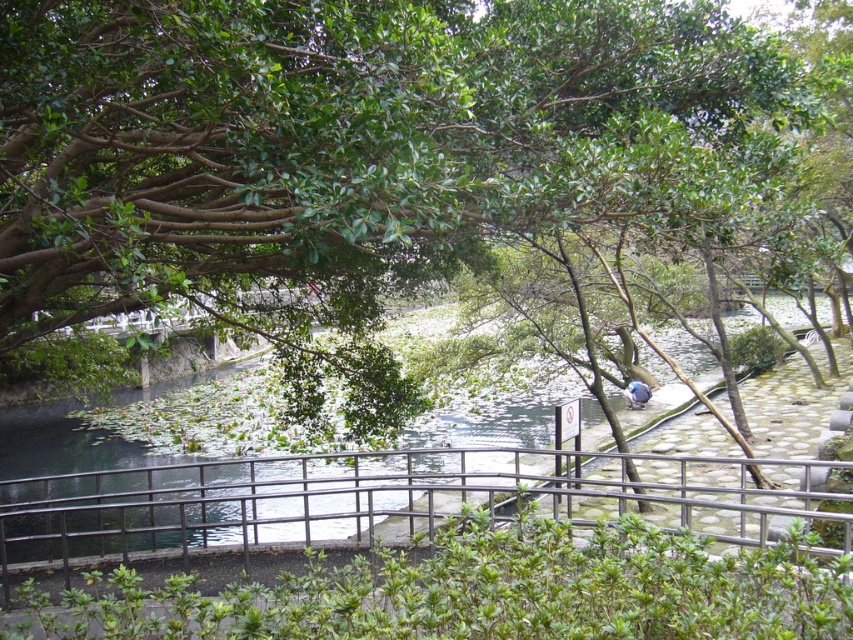
You are standing in the serene outdoor scene and want to take a photo of the green leafy tree at upper center. According to the image coordinates, where exactly should you aim your camera to capture it?

The green leafy tree at upper center is located at the 2D coordinates point (351,145), so you should aim your camera at that point to capture it.

You are standing at the metal railing in the middle of the scene and want to look at two points in the image, point (483, 136) and point (264, 499). Which point is closer to you?

Point (483, 136) is closer to the viewer than point (264, 499).

You are a painter standing at the edge of the water and want to paint the green leafy tree at upper center and the metallic gray railing at center. Which object is closer to the water surface?

The metallic gray railing at center is closer to the water surface because the green leafy tree at upper center is positioned over it, meaning the tree is higher up and the railing is lower near the water.